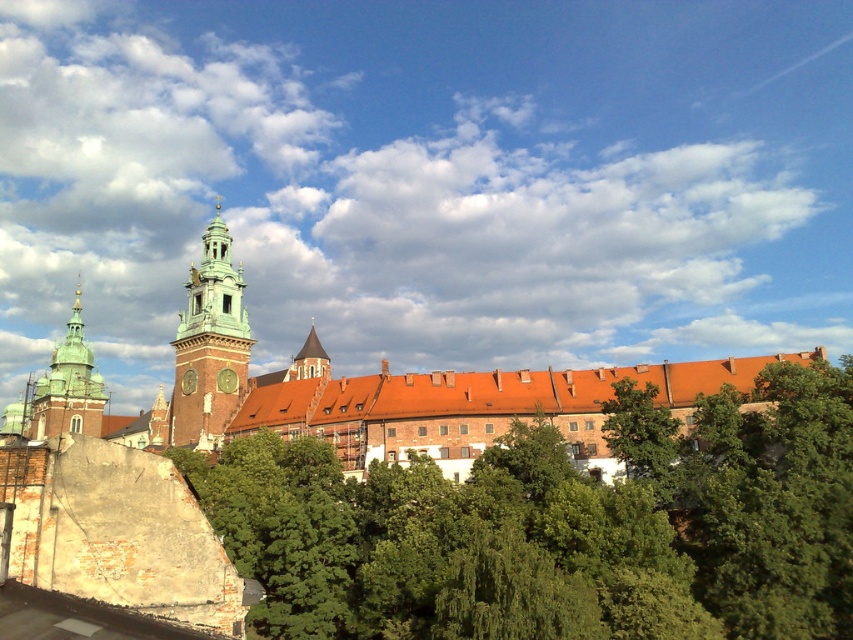
Question: Which is farther from the green copper tower at upper left?

Choices:
 (A) green stone tower at center-left
 (B) brown brick church at center
 (C) green leafy tree at center

Answer: (C)

Question: Which point appears farthest from the camera in this image?

Choices:
 (A) (210, 316)
 (B) (418, 278)

Answer: (B)

Question: Does white fluffy cloud at upper center come behind green stone tower at center-left?

Choices:
 (A) yes
 (B) no

Answer: (A)

Question: Which is nearer to the green stone tower at center-left?

Choices:
 (A) green copper tower at upper left
 (B) brown brick church at center
 (C) white fluffy cloud at upper center

Answer: (B)

Question: Can you confirm if white fluffy cloud at upper center is thinner than brown brick church at center?

Choices:
 (A) no
 (B) yes

Answer: (A)

Question: Is white fluffy cloud at upper center further to the viewer compared to green stone tower at center-left?

Choices:
 (A) yes
 (B) no

Answer: (A)